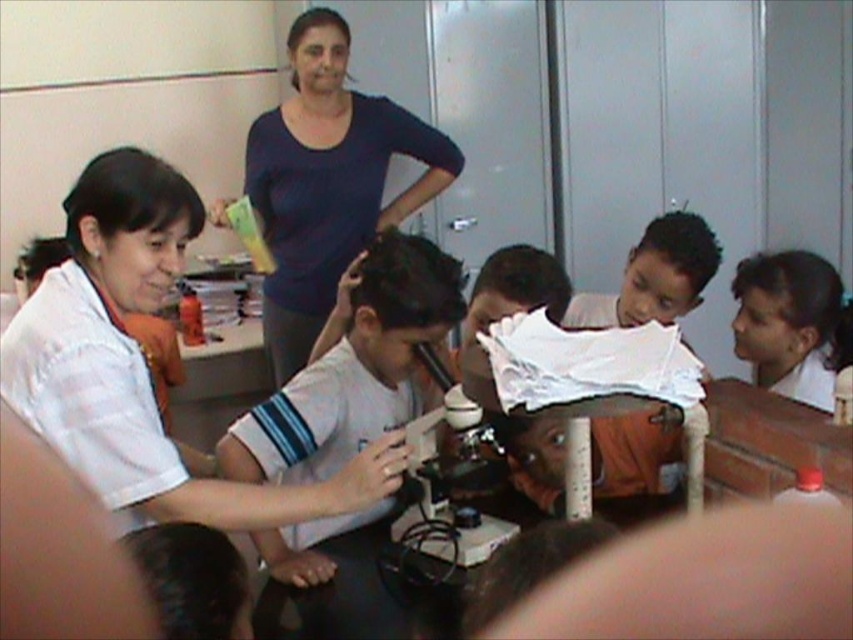
You are a student sitting at the table in the classroom scene. You need to hand a note to the adult in the dark blue shirt at upper center. The metallic microscope at center is in your way. Can you reach the adult without moving the microscope?

The dark blue shirt at upper center is much taller than the metallic microscope at center, so you can reach the adult by looking up since the adult is taller than the microscope.